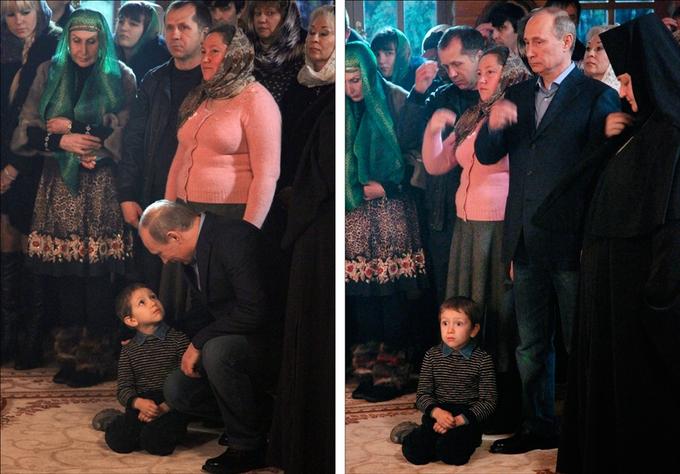
Locate an element on the screen. This screenshot has height=474, width=680. window is located at coordinates (417, 18).